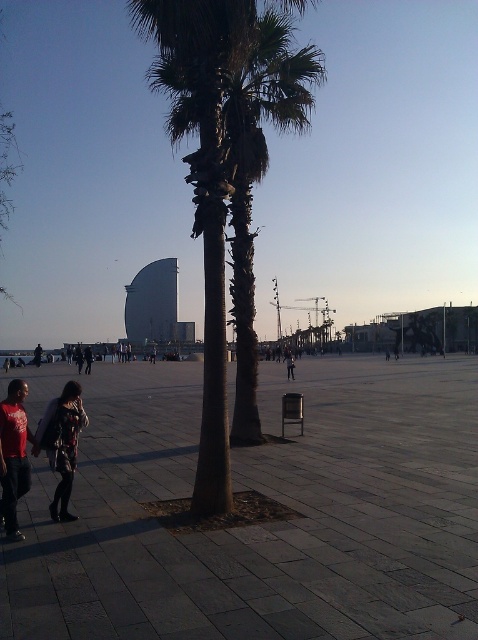
Question: Is dark stone plaza at center to the left of dark gray fabric coat at lower left from the viewer's perspective?

Choices:
 (A) no
 (B) yes

Answer: (A)

Question: From the image, what is the correct spatial relationship of dark gray fabric coat at lower left in relation to red cotton shirt at lower left?

Choices:
 (A) above
 (B) below

Answer: (A)

Question: Which point is farther to the camera?

Choices:
 (A) [x=60, y=509]
 (B) [x=292, y=372]
 (C) [x=2, y=481]

Answer: (B)

Question: Which object is the closest to the dark gray pants at center?

Choices:
 (A) dark stone plaza at center
 (B) dark gray fabric coat at lower left
 (C) red cotton shirt at lower left

Answer: (A)

Question: Does dark gray fabric coat at lower left appear on the right side of red cotton shirt at lower left?

Choices:
 (A) no
 (B) yes

Answer: (B)

Question: Which point is closer to the camera?

Choices:
 (A) red cotton shirt at lower left
 (B) dark gray pants at center

Answer: (A)